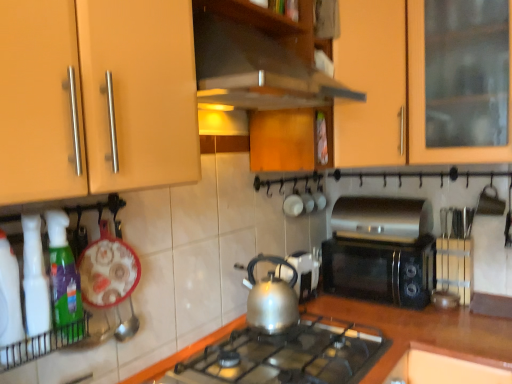
Image resolution: width=512 pixels, height=384 pixels. What are the coordinates of `free space in front of black plastic microwave at center-right, the 3th kitchen appliance positioned from the left` in the screenshot? It's located at point(430,328).